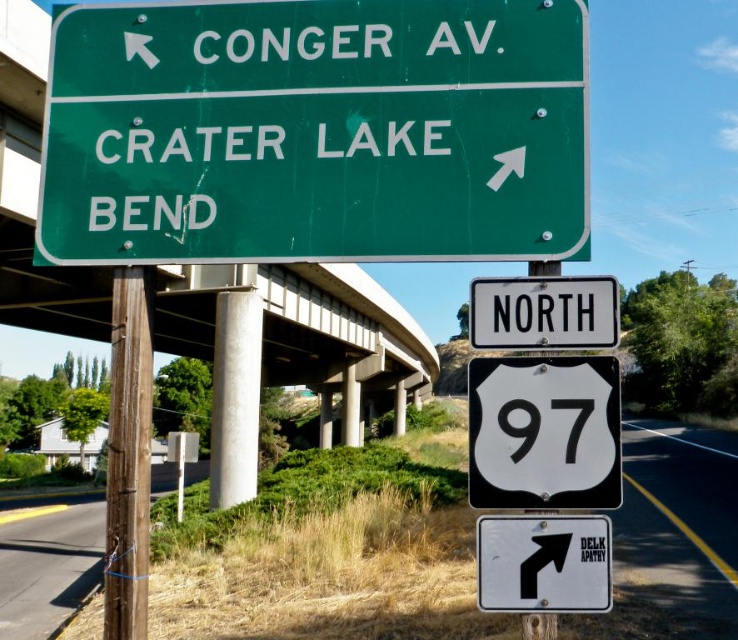
Who is shorter, green matte sign at upper center or white plastic highway sign at center?

With less height is green matte sign at upper center.

Is point (234, 120) positioned in front of point (303, 586)?

Yes.

At what (x,y) coordinates should I click in order to perform the action: click on green matte sign at upper center. Please return your answer as a coordinate pair (x, y). Looking at the image, I should click on (314, 131).

Can you confirm if white plastic highway sign at center is bigger than white plastic arrow at upper center?

Yes, white plastic highway sign at center is bigger than white plastic arrow at upper center.

Between white plastic highway sign at center and white plastic arrow at upper center, which one is positioned higher?

Positioned higher is white plastic arrow at upper center.

The width and height of the screenshot is (738, 640). What do you see at coordinates (331, 579) in the screenshot?
I see `white plastic highway sign at center` at bounding box center [331, 579].

This screenshot has height=640, width=738. What are the coordinates of `white plastic highway sign at center` in the screenshot? It's located at (331, 579).

Is green matte sign at upper center shorter than green metal sign at upper left?

Yes.

Is point (455, 168) positioned in front of point (317, 332)?

Yes, point (455, 168) is closer to viewer.

Identify the location of green matte sign at upper center. This screenshot has width=738, height=640. (314, 131).